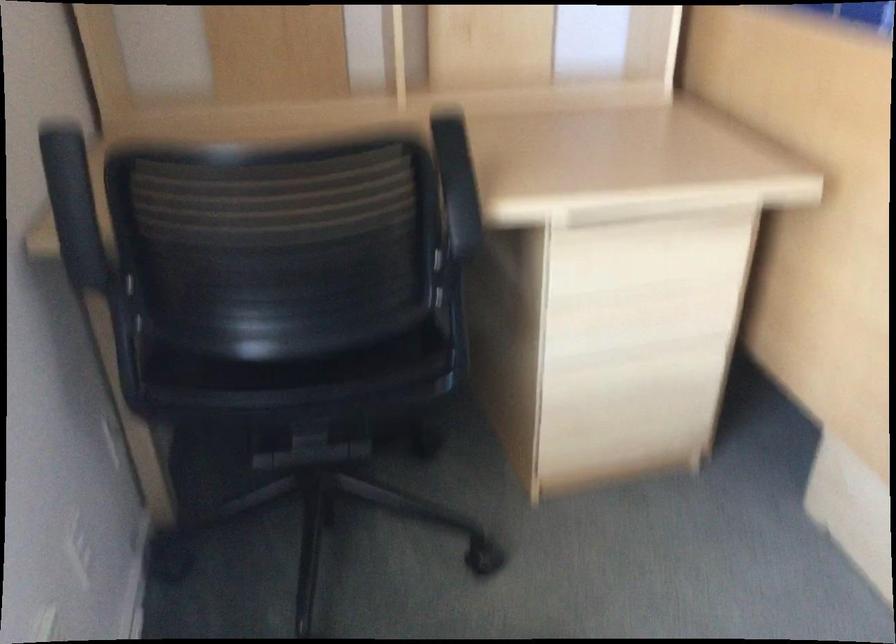
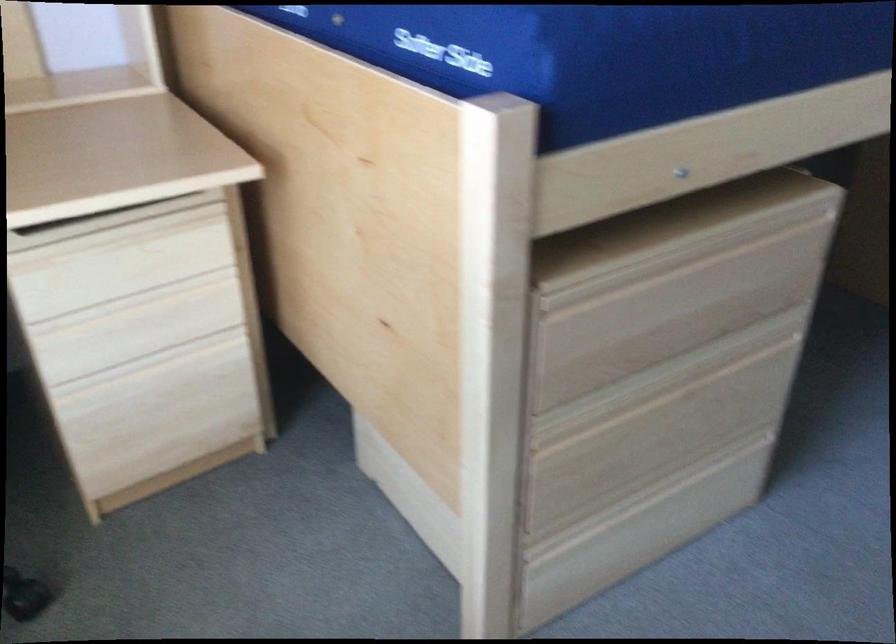
Question: What movement of the cameraman would produce the second image?

Choices:
 (A) Left
 (B) Right
 (C) Forward
 (D) Backward

Answer: (B)